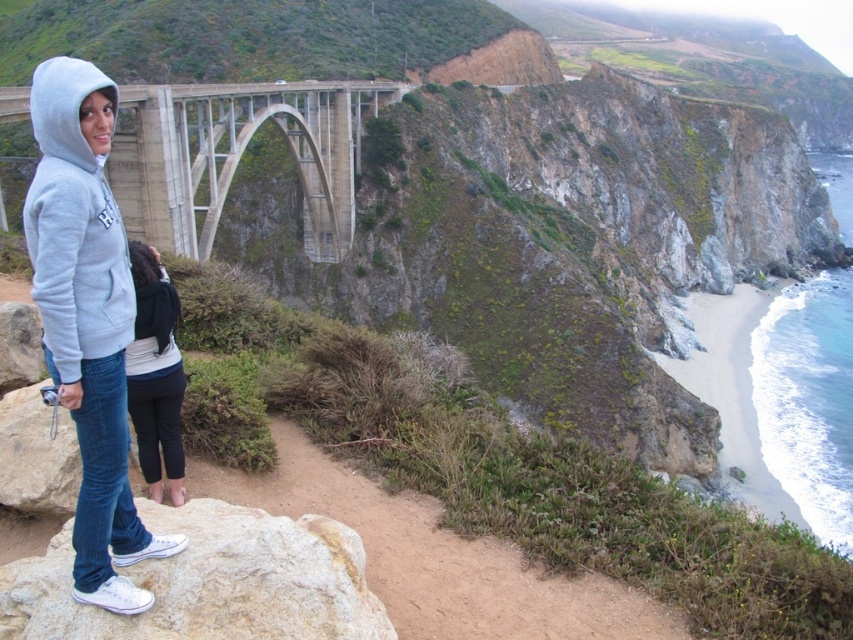
Is white sand beach at lower right to the left of black cotton pants at lower left from the viewer's perspective?

Incorrect, white sand beach at lower right is not on the left side of black cotton pants at lower left.

Is white sand beach at lower right wider than black cotton pants at lower left?

Correct, the width of white sand beach at lower right exceeds that of black cotton pants at lower left.

Who is more distant from viewer, (703, 320) or (178, 465)?

Positioned behind is point (703, 320).

Where is `white sand beach at lower right`? The height and width of the screenshot is (640, 853). white sand beach at lower right is located at coordinates (732, 388).

Who is lower down, smooth beige rock at lower left or white sand beach at lower right?

smooth beige rock at lower left is lower down.

Can you confirm if smooth beige rock at lower left is bigger than white sand beach at lower right?

No, smooth beige rock at lower left is not bigger than white sand beach at lower right.

Who is more distant from viewer, (53, 625) or (699, 332)?

The point (699, 332) is more distant.

Locate an element on the screen. This screenshot has width=853, height=640. smooth beige rock at lower left is located at coordinates (210, 582).

Can you confirm if light gray hoodie at center is positioned to the right of smooth beige rock at lower left?

No, light gray hoodie at center is not to the right of smooth beige rock at lower left.

Does point (115, 330) come closer to viewer compared to point (38, 628)?

No.

Is point (109, 248) closer to viewer compared to point (286, 582)?

No.

Image resolution: width=853 pixels, height=640 pixels. I want to click on light gray hoodie at center, so click(86, 321).